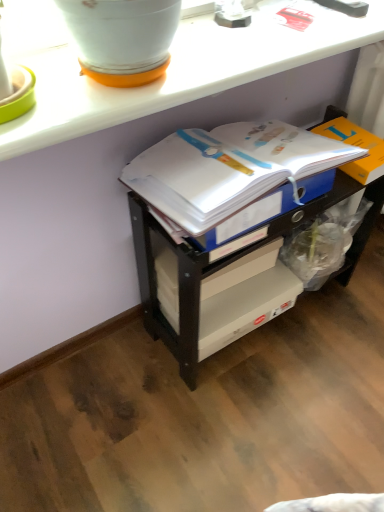
In order to face white glossy counter at upper center, should I rotate leftwards or rightwards?

You should look right and rotate roughly 4.940 degrees.

Locate an element on the screen. white glossy flowerpot at upper left is located at coordinates (121, 38).

What is the approximate width of orange cardboard box at right?

orange cardboard box at right is 7.80 inches in width.

Locate an element on the screen. This screenshot has width=384, height=512. white paper journal at center is located at coordinates (229, 169).

From a real-world perspective, is white glossy flowerpot at upper left on white paper journal at center?

Correct, in the physical world, white glossy flowerpot at upper left is higher than white paper journal at center.

Is point (109, 55) closer to camera compared to point (204, 191)?

Yes.

Is white glossy flowerpot at upper left taller than white paper journal at center?

Yes.

Considering the relative sizes of white glossy flowerpot at upper left and white paper journal at center in the image provided, is white glossy flowerpot at upper left thinner than white paper journal at center?

Yes, white glossy flowerpot at upper left is thinner than white paper journal at center.

Is white plastic shelf at center taller than orange cardboard box at right?

Correct, white plastic shelf at center is much taller as orange cardboard box at right.

From the picture: Is white plastic shelf at center at the right side of orange cardboard box at right?

No, white plastic shelf at center is not to the right of orange cardboard box at right.

Looking at their sizes, would you say white plastic shelf at center is wider or thinner than orange cardboard box at right?

Considering their sizes, white plastic shelf at center looks broader than orange cardboard box at right.

Considering their positions, is white plastic shelf at center located in front of or behind orange cardboard box at right?

Clearly, white plastic shelf at center is in front of orange cardboard box at right.

Would you say white plastic shelf at center is inside or outside white paper journal at center?

white plastic shelf at center is outside white paper journal at center.

Which object is positioned more to the left, white plastic shelf at center or white paper journal at center?

white paper journal at center is more to the left.

Is point (177, 343) closer to viewer compared to point (223, 198)?

No, it is behind (223, 198).

Consider the image. Between white plastic shelf at center and white paper journal at center, which one has smaller width?

Thinner between the two is white paper journal at center.

Can you confirm if white paper journal at center is wider than white glossy flowerpot at upper left?

Indeed, white paper journal at center has a greater width compared to white glossy flowerpot at upper left.

Can you confirm if white paper journal at center is positioned to the right of white glossy flowerpot at upper left?

Correct, you'll find white paper journal at center to the right of white glossy flowerpot at upper left.

Considering the sizes of white paper journal at center and white glossy flowerpot at upper left in the image, is white paper journal at center taller or shorter than white glossy flowerpot at upper left?

In the image, white paper journal at center appears to be shorter than white glossy flowerpot at upper left.

Are white glossy counter at upper center and white paper journal at center beside each other?

They are not placed beside each other.

From a real-world perspective, between white glossy counter at upper center and white paper journal at center, who is vertically higher?

white glossy counter at upper center.

Is white glossy counter at upper center oriented away from white paper journal at center?

No, white paper journal at center is not at the back of white glossy counter at upper center.

From the image's perspective, is white glossy flowerpot at upper left above orange cardboard box at right?

Yes, from the image's perspective, white glossy flowerpot at upper left is on top of orange cardboard box at right.

From a real-world perspective, who is located higher, white glossy flowerpot at upper left or orange cardboard box at right?

white glossy flowerpot at upper left, from a real-world perspective.

Which object is thinner, white glossy flowerpot at upper left or orange cardboard box at right?

With smaller width is orange cardboard box at right.

From the picture: Considering the sizes of objects white glossy flowerpot at upper left and orange cardboard box at right in the image provided, who is bigger, white glossy flowerpot at upper left or orange cardboard box at right?

white glossy flowerpot at upper left.

Would you say white glossy counter at upper center is outside white glossy flowerpot at upper left?

Yes, white glossy counter at upper center is not within white glossy flowerpot at upper left.

Looking at this image, considering the sizes of white glossy counter at upper center and white glossy flowerpot at upper left in the image, is white glossy counter at upper center taller or shorter than white glossy flowerpot at upper left?

white glossy counter at upper center is shorter than white glossy flowerpot at upper left.

From the image's perspective, is white glossy counter at upper center located above white glossy flowerpot at upper left?

Yes.

Considering the positions of points (190, 19) and (157, 74), is point (190, 19) farther from camera compared to point (157, 74)?

Yes, point (190, 19) is behind point (157, 74).

I want to click on flowerpot in front of the white paper journal at center, so click(x=121, y=38).

Locate an element on the screen. Image resolution: width=384 pixels, height=512 pixels. shelf lying on the left of orange cardboard box at right is located at coordinates (215, 283).

Looking at the image, which one is located further to white plastic shelf at center, white glossy counter at upper center or orange cardboard box at right?

white glossy counter at upper center is positioned further to the anchor white plastic shelf at center.

Based on their spatial positions, is white plastic shelf at center or white glossy counter at upper center further from orange cardboard box at right?

The object further to orange cardboard box at right is white plastic shelf at center.

When comparing their distances from white glossy counter at upper center, does white paper journal at center or white glossy flowerpot at upper left seem closer?

Among the two, white glossy flowerpot at upper left is located nearer to white glossy counter at upper center.

Which object lies further to the anchor point white glossy counter at upper center, orange cardboard box at right or white paper journal at center?

orange cardboard box at right lies further to white glossy counter at upper center than the other object.

Looking at the image, which one is located further to white paper journal at center, white glossy flowerpot at upper left or white plastic shelf at center?

The object further to white paper journal at center is white glossy flowerpot at upper left.

Estimate the real-world distances between objects in this image. Which object is further from white glossy counter at upper center, white glossy flowerpot at upper left or white plastic shelf at center?

white plastic shelf at center is positioned further to the anchor white glossy counter at upper center.

Considering their positions, is white glossy flowerpot at upper left positioned closer to orange cardboard box at right than white glossy counter at upper center?

Based on the image, white glossy counter at upper center appears to be nearer to orange cardboard box at right.

Which object lies further to the anchor point orange cardboard box at right, white glossy counter at upper center or white plastic shelf at center?

Among the two, white plastic shelf at center is located further to orange cardboard box at right.

Locate an element on the screen. journal between white glossy counter at upper center and orange cardboard box at right from front to back is located at coordinates (229, 169).

Identify the location of shelf located between white paper journal at center and orange cardboard box at right in the left-right direction. The width and height of the screenshot is (384, 512). (215, 283).

Identify the location of counter between white glossy flowerpot at upper left and white paper journal at center in the front-back direction. This screenshot has width=384, height=512. (182, 71).

Locate an element on the screen. Image resolution: width=384 pixels, height=512 pixels. journal between white glossy flowerpot at upper left and orange cardboard box at right in the horizontal direction is located at coordinates (229, 169).